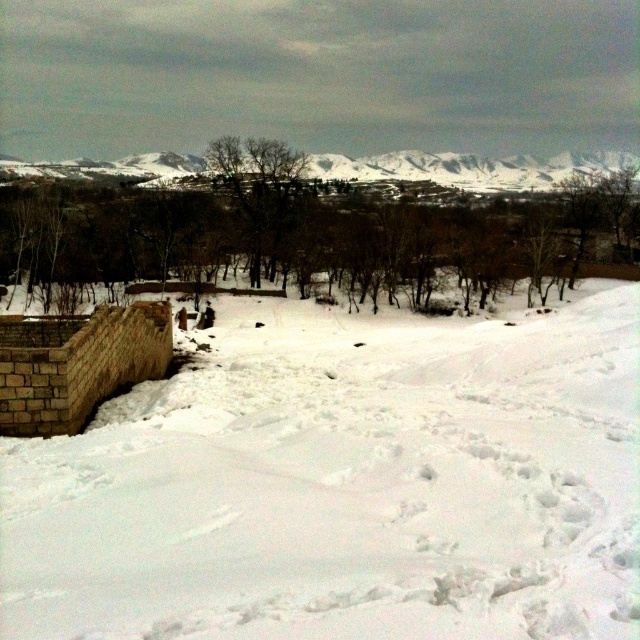
Question: Which point is closer to the camera?

Choices:
 (A) white powdery snow at center
 (B) brown leafless trees at center
 (C) snowy rocky mountain at upper center

Answer: (A)

Question: Can you confirm if white powdery snow at center is positioned to the right of brown leafless trees at center?

Choices:
 (A) yes
 (B) no

Answer: (B)

Question: Where is brown leafless trees at center located in relation to snowy rocky mountain at upper center in the image?

Choices:
 (A) above
 (B) below

Answer: (B)

Question: Which point appears closest to the camera in this image?

Choices:
 (A) (620, 154)
 (B) (260, 372)
 (C) (54, 228)

Answer: (B)

Question: Which of the following is the farthest from the observer?

Choices:
 (A) (152, 156)
 (B) (493, 182)
 (C) (496, 365)

Answer: (A)

Question: Is white powdery snow at center closer to the viewer compared to snowy rocky mountain at upper center?

Choices:
 (A) yes
 (B) no

Answer: (A)